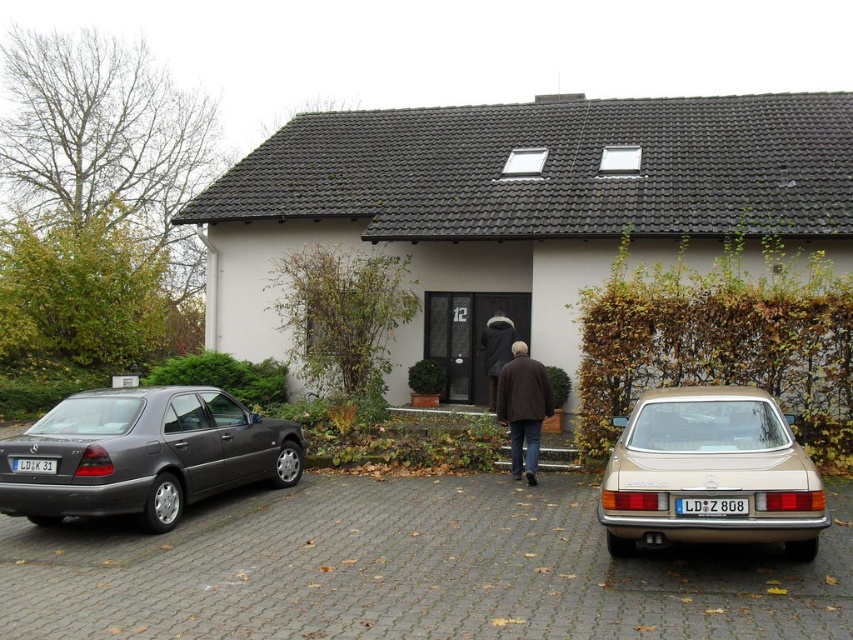
You are a delivery person trying to park your van in the driveway. The van requires a space larger than the blue plastic license plate at center. Can you park your van in the gray cobblestone driveway at center?

The gray cobblestone driveway at center is larger in size than the blue plastic license plate at center, so yes, the van can park there since the driveway provides sufficient space.

You are a delivery person trying to park your delivery van, which is 2 meters wide, on the gray cobblestone driveway at center. The blue plastic license plate at center is blocking part of the driveway. Can you determine if there is enough space to park your van on the driveway?

The gray cobblestone driveway at center is wider than the blue plastic license plate at center. Since the driveway is wider than the license plate, there might be enough space for the van, but the exact width isn